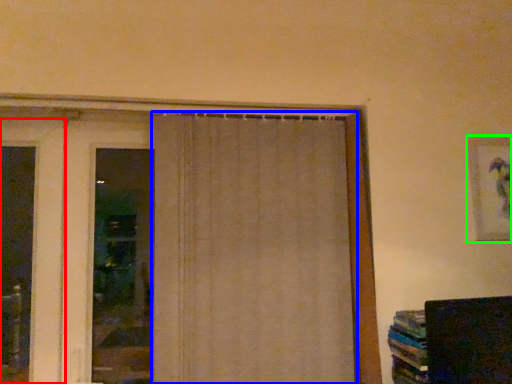
Question: Which object is positioned closest to door (highlighted by a red box)? Select from curtain (highlighted by a blue box) and picture frame (highlighted by a green box).

Choices:
 (A) curtain
 (B) picture frame

Answer: (A)